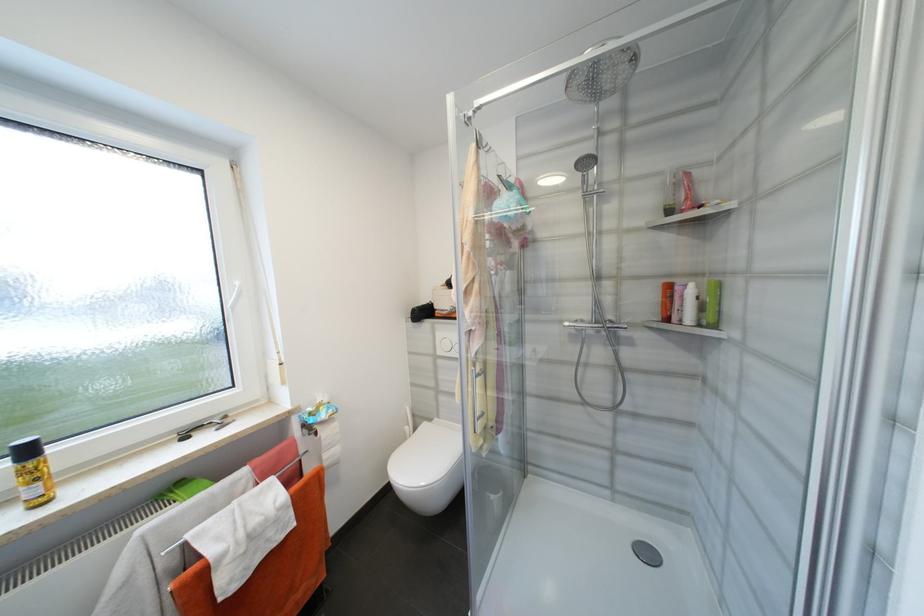
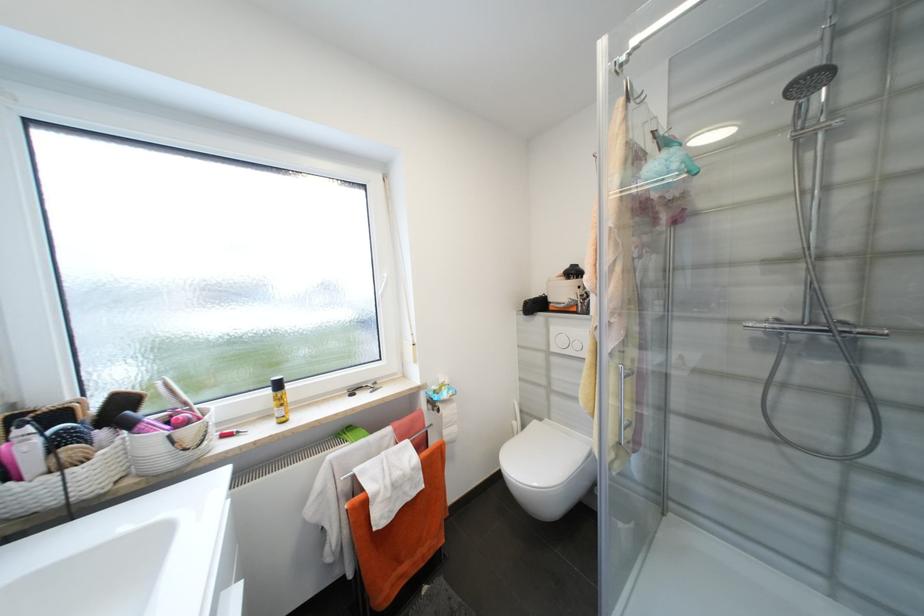
The point at (33,453) is marked in the first image. Where is the corresponding point in the second image?

(284, 386)